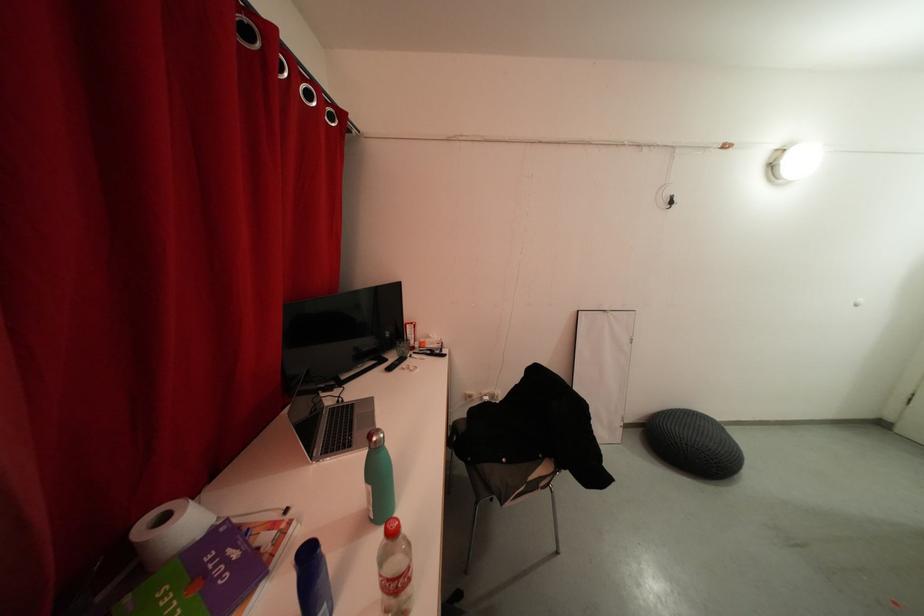
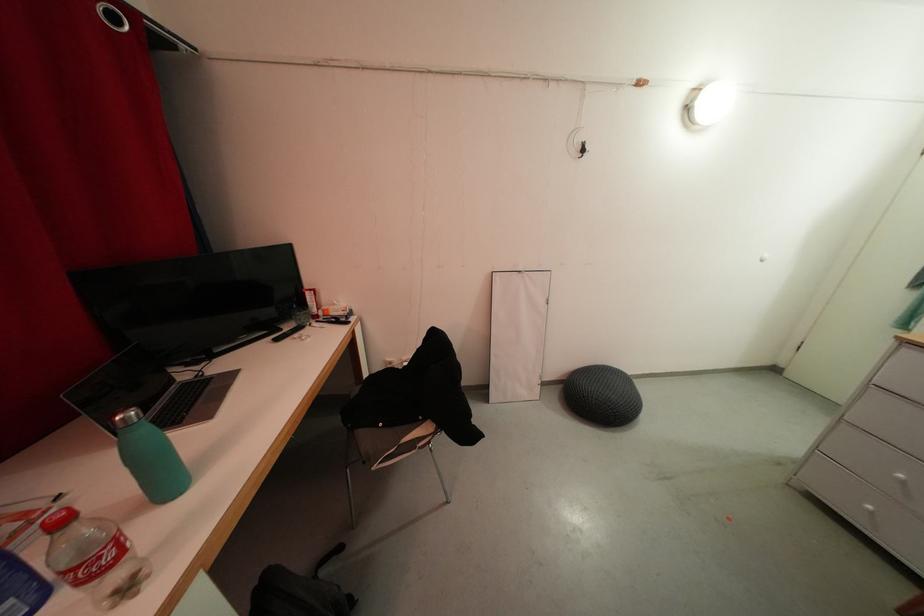
Question: Based on the continuous images, in which direction is the camera rotating? Reply with the corresponding letter.

Choices:
 (A) Left
 (B) Right
 (C) Up
 (D) Down

Answer: (D)